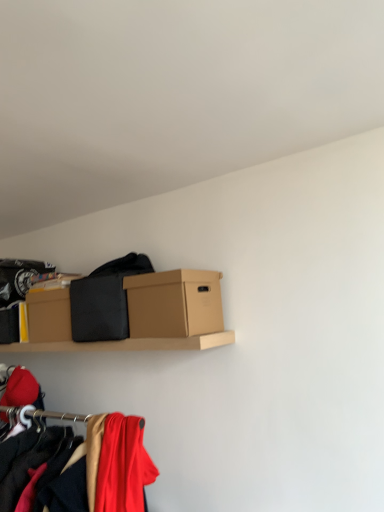
Question: In terms of size, does matte red fabric at lower left, marked as the 2th clothing in a back-to-front arrangement, appear bigger or smaller than black matte fabric at center, the 2th clothing from the front?

Choices:
 (A) big
 (B) small

Answer: (B)

Question: Would you say matte red fabric at lower left, which ranks as the 1th clothing in front-to-back order, is inside or outside black matte fabric at center, the 1th clothing when ordered from back to front?

Choices:
 (A) inside
 (B) outside

Answer: (B)

Question: Considering the real-world distances, which object is closest to the black matte fabric at center, the 1th clothing when ordered from back to front?

Choices:
 (A) brown cardboard box at center
 (B) matte red fabric at lower left, marked as the first clothing in a bottom-to-top arrangement

Answer: (A)

Question: Which is farther from the black matte fabric at center, the second clothing in the bottom-to-top sequence?

Choices:
 (A) matte red fabric at lower left, marked as the 2th clothing in a back-to-front arrangement
 (B) brown cardboard box at center

Answer: (A)